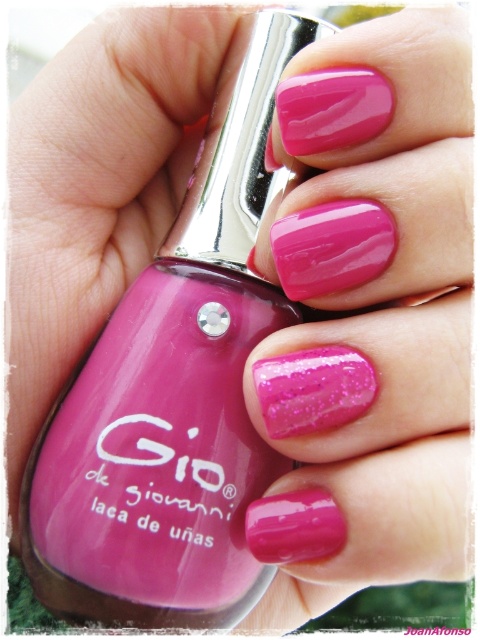
You are a beauty consultant helping a customer choose between the glossy pink nails at center and the glossy pink nail polish at center. The customer wants to know which one has a smaller width. Which one should you recommend?

The glossy pink nails at center is thinner than the glossy pink nail polish at center, so the glossy pink nails at center has a smaller width.

You are a beauty consultant trying to recommend a nail polish to a customer. You show them an image where both the glossy pink nails at center and the glossy pink nail polish at center are visible. Which one is closer to the viewer?

The glossy pink nails at center are closer to the viewer than the glossy pink nail polish at center because the glossy pink nails at center is in front of the glossy pink nail polish at center.